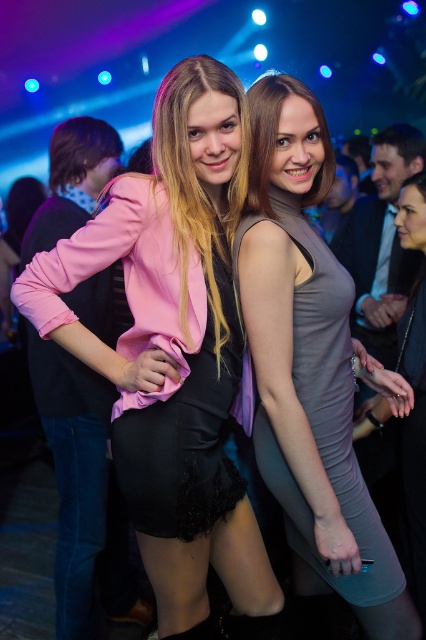
You are at a party and want to take a photo of the two points in the image. The first point is at coordinates point (195, 472) and the second point is at point (322, 406). Which point will appear closer to the camera in your photo?

Point (195, 472) is further to the camera than point (322, 406), so it will appear closer to the camera in the photo.

You are a photographer at a party and need to decide which dress to focus on for a closeup shot. Since the pink satin dress at center is wider than the satin gray dress at center, which dress should you choose to ensure it fits entirely within the camera frame without cropping?

The pink satin dress at center is wider than the satin gray dress at center, so you should choose the pink satin dress at center to ensure it fits entirely within the camera frame without cropping.

You are a photographer at a party and want to take a photo of the pink satin dress at center and the satin gray dress at center. Which dress should you focus on to ensure it appears larger in the photo?

The pink satin dress at center is much taller than the satin gray dress at center, so focusing on the pink satin dress at center will make it appear larger in the photo.